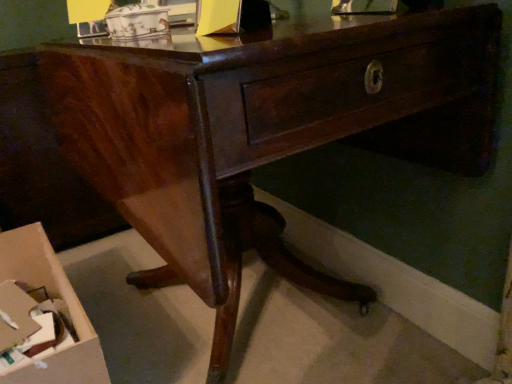
The image size is (512, 384). Describe the element at coordinates (54, 296) in the screenshot. I see `cardboard box at lower left` at that location.

Measure the distance between point (50,255) and camera.

Point (50,255) is 3.99 feet from camera.

The image size is (512, 384). In order to click on cardboard box at lower left in this screenshot , I will do `click(54, 296)`.

Where is `cardboard box at lower left`? Image resolution: width=512 pixels, height=384 pixels. cardboard box at lower left is located at coordinates (54, 296).